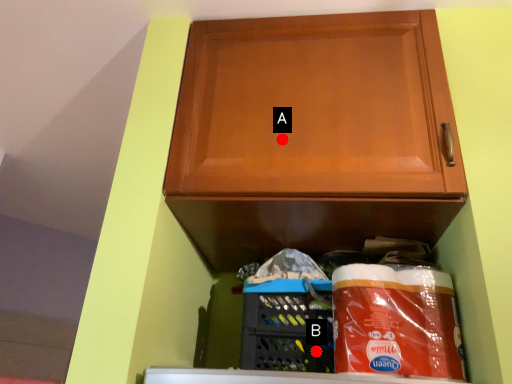
Question: Two points are circled on the image, labeled by A and B beside each circle. Among these points, which one is farthest from the camera?

Choices:
 (A) A is further
 (B) B is further

Answer: (B)